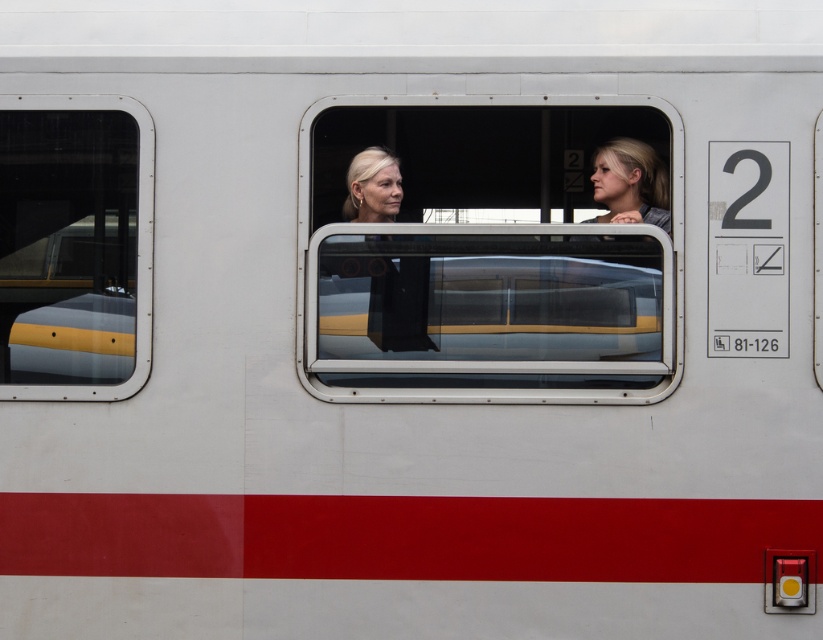
Is transparent glass train window at center above smooth blonde hair at center?

No, transparent glass train window at center is not above smooth blonde hair at center.

Is point (568, 348) positioned behind point (649, 221)?

That is False.

Image resolution: width=823 pixels, height=640 pixels. I want to click on transparent glass train window at center, so click(487, 292).

Does clear glass train window at left have a greater width compared to matte black hair at center?

Yes, clear glass train window at left is wider than matte black hair at center.

Is point (64, 232) positioned before point (375, 234)?

That is False.

Locate an element on the screen. The height and width of the screenshot is (640, 823). clear glass train window at left is located at coordinates (73, 248).

Does point (621, 273) lie in front of point (416, 316)?

Yes, it is in front of point (416, 316).

Between point (560, 368) and point (425, 333), which one is positioned in front?

Point (560, 368)

Find the location of `transparent glass train window at center`. transparent glass train window at center is located at coordinates (487, 292).